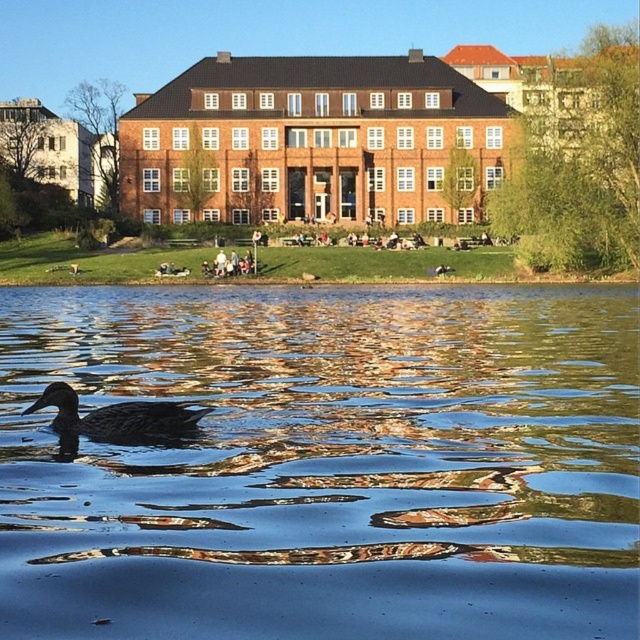
Can you confirm if shiny blue water at center is shorter than brown matte duck at lower left?

In fact, shiny blue water at center may be taller than brown matte duck at lower left.

Is the position of shiny blue water at center more distant than that of brown matte duck at lower left?

No.

Is point (154, 564) behind point (168, 420)?

No, it is not.

At what (x,y) coordinates should I click in order to perform the action: click on shiny blue water at center. Please return your answer as a coordinate pair (x, y). Image resolution: width=640 pixels, height=640 pixels. Looking at the image, I should click on (324, 465).